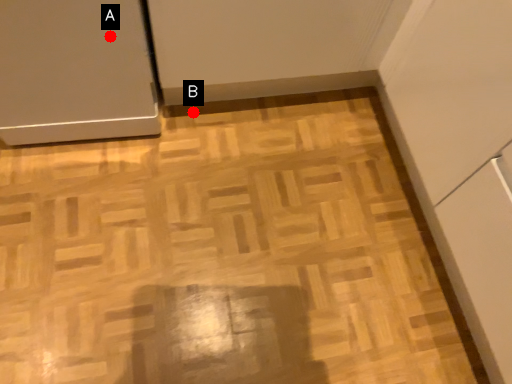
Question: Two points are circled on the image, labeled by A and B beside each circle. Which point is farther to the camera?

Choices:
 (A) A is further
 (B) B is further

Answer: (B)